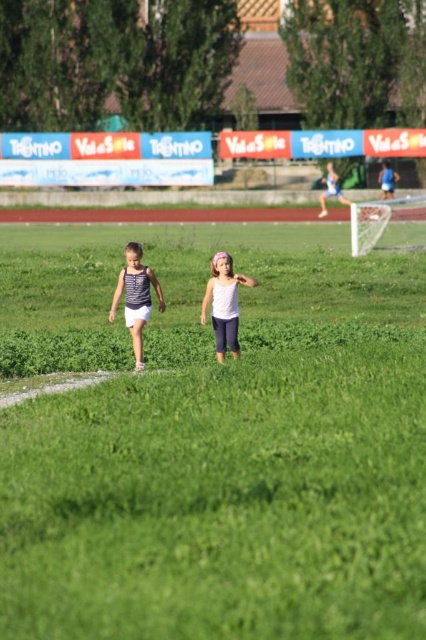
Can you confirm if green grass at center is positioned to the right of white cotton tank top at center?

Yes, green grass at center is to the right of white cotton tank top at center.

Consider the image. Who is higher up, green grass at center or white cotton tank top at center?

Positioned higher is white cotton tank top at center.

Does point (256, 460) lie in front of point (146, 285)?

Yes, it is.

You are a GUI agent. You are given a task and a screenshot of the screen. Output one action in this format:
    pyautogui.click(x=<x>, y=<y>)
    Task: Click on the green grass at center
    This screenshot has height=640, width=426.
    Given the screenshot: What is the action you would take?
    pyautogui.click(x=213, y=442)

Between green grass at center and white matte tank top at center, which one is positioned lower?

green grass at center is lower down.

Can you confirm if green grass at center is taller than white matte tank top at center?

Indeed, green grass at center has a greater height compared to white matte tank top at center.

Identify the location of green grass at center. click(x=213, y=442).

The image size is (426, 640). I want to click on green grass at center, so click(213, 442).

Does white cotton tank top at center have a greater width compared to white matte tank top at center?

No.

Find the location of a particular element. This screenshot has width=426, height=640. white cotton tank top at center is located at coordinates (135, 298).